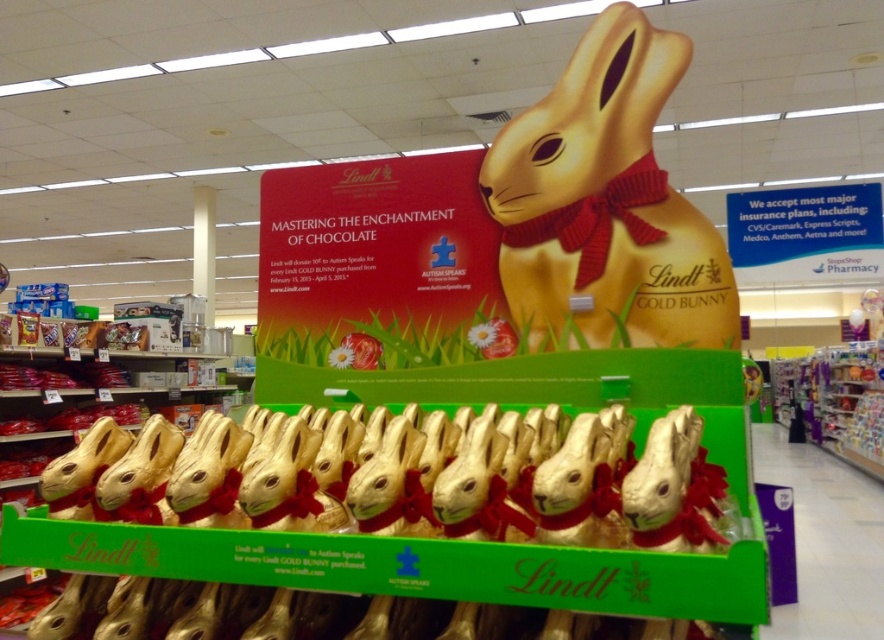
You are a customer at the supermarket and want to buy a Lindt Gold Bunny chocolate. You see two items on the display stand described above. Which item is wider between the gold shiny chocolate bunnies at center and the gold shiny bunny at center?

The gold shiny chocolate bunnies at center are wider than the gold shiny bunny at center.

You are a customer looking at the Lindt Gold Bunny display. You see the gold shiny chocolate bunnies at center and the gold shiny bunny at center. Which one is closer to you?

The gold shiny chocolate bunnies at center are closer to you because they are in front of the gold shiny bunny at center.